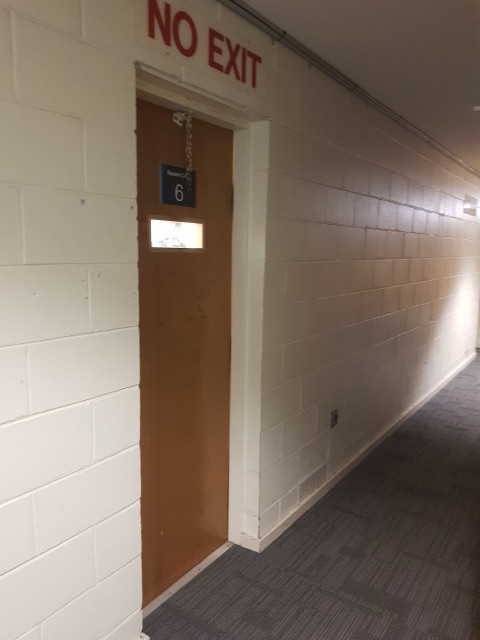
I want to click on door, so click(186, 326).